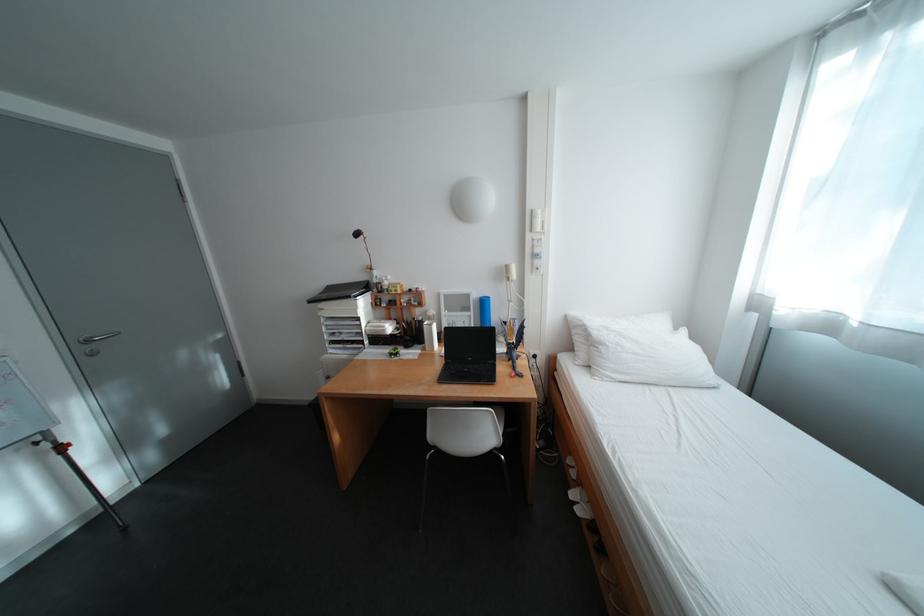
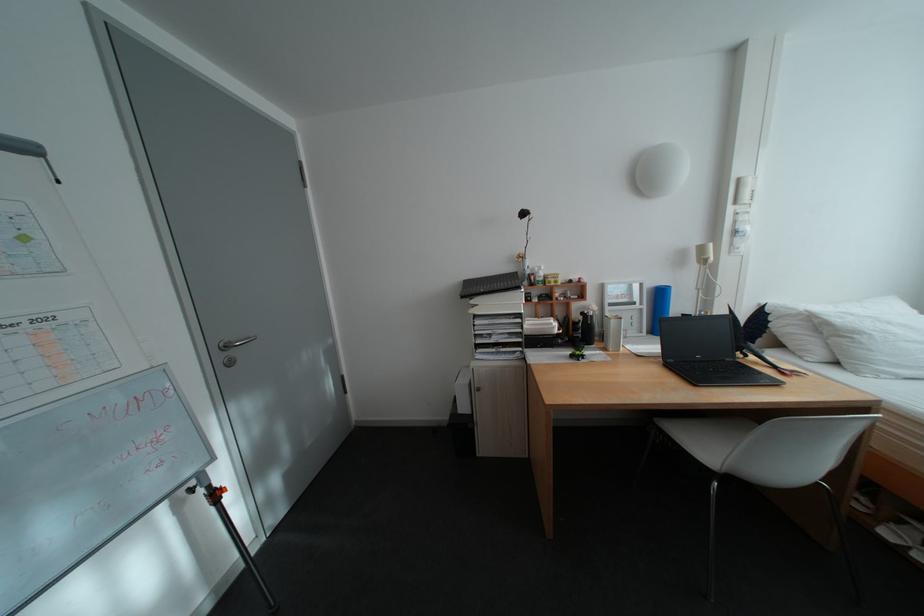
Find the pixel in the second image that matches (484,314) in the first image.

(657, 307)